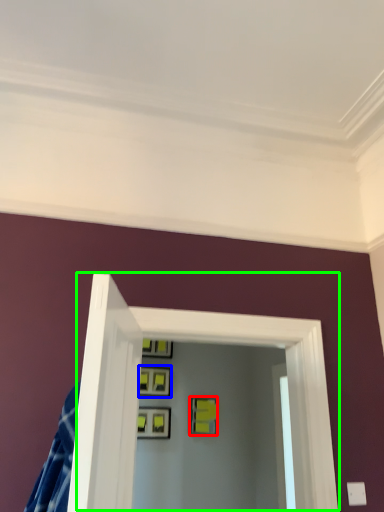
Question: Estimate the real-world distances between objects in this image. Which object is closer to picture frame (highlighted by a red box), picture frame (highlighted by a blue box) or glass door (highlighted by a green box)?

Choices:
 (A) picture frame
 (B) glass door

Answer: (A)